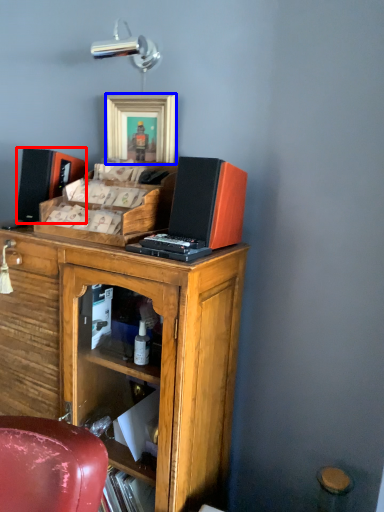
Question: Which of the following is the closest to the observer, speaker (highlighted by a red box) or picture frame (highlighted by a blue box)?

Choices:
 (A) speaker
 (B) picture frame

Answer: (B)